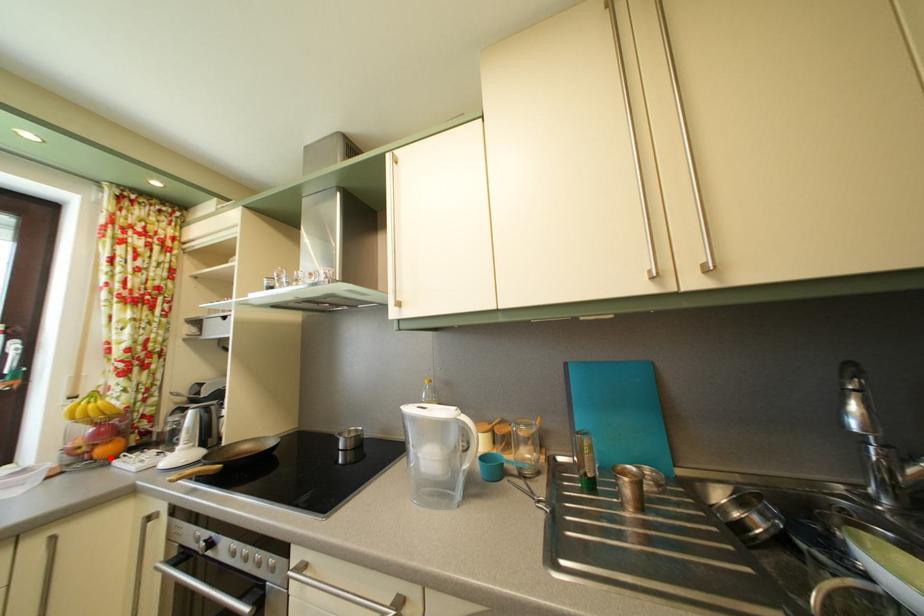
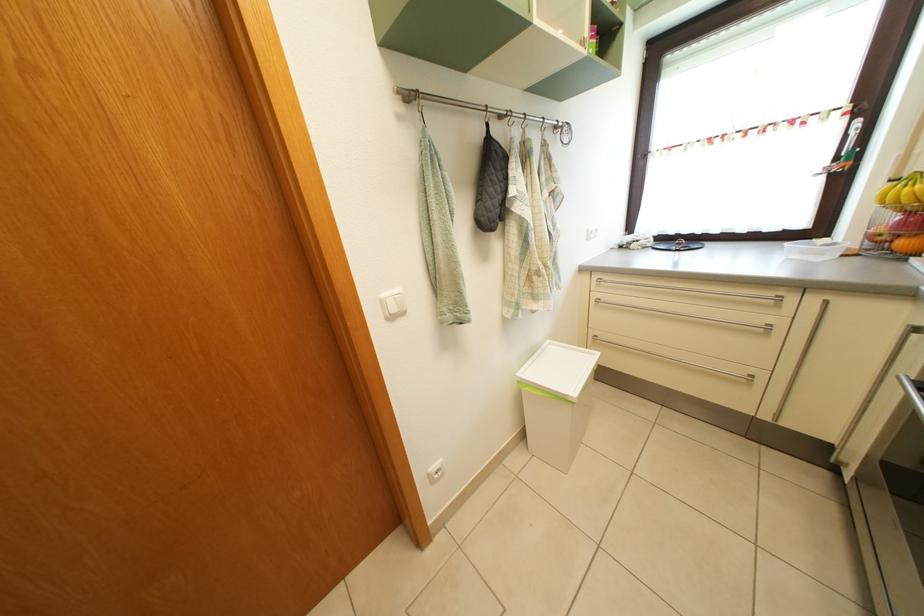
Find the pixel in the second image that matches the highlighted location in the first image.

(910, 252)